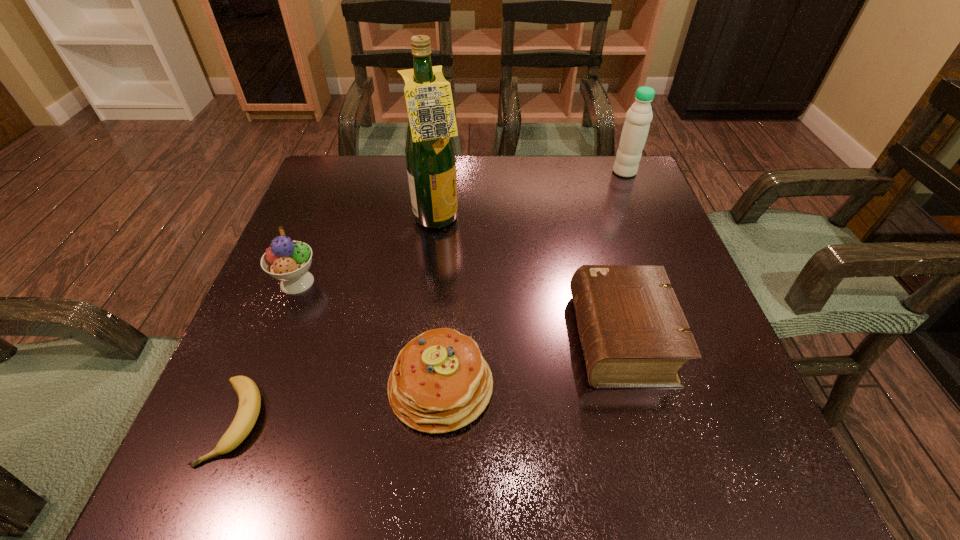
You are a GUI agent. You are given a task and a screenshot of the screen. Output one action in this format:
    pyautogui.click(x=<x>, y=<y>)
    Task: Click on the banana that is at the left edge
    Image resolution: width=960 pixels, height=540 pixels.
    Given the screenshot: What is the action you would take?
    pyautogui.click(x=249, y=395)

Where is `water bottle present at the right edge`? Image resolution: width=960 pixels, height=540 pixels. water bottle present at the right edge is located at coordinates (639, 116).

Locate an element on the screen. The image size is (960, 540). Bible located at the right edge is located at coordinates (634, 334).

The width and height of the screenshot is (960, 540). What are the coordinates of `object at the near left corner` in the screenshot? It's located at pyautogui.click(x=249, y=395).

Find the location of a particular element. object present at the far right corner is located at coordinates (639, 116).

Where is `free space at the far edge`? free space at the far edge is located at coordinates (384, 178).

Find the location of a particular element. vacant space at the near edge of the desktop is located at coordinates tap(449, 442).

The height and width of the screenshot is (540, 960). In the image, there is a desktop. Identify the location of vacant space at the left edge. (281, 320).

The image size is (960, 540). Identify the location of free space at the right edge. (609, 210).

I want to click on vacant space at the far left corner of the desktop, so click(372, 190).